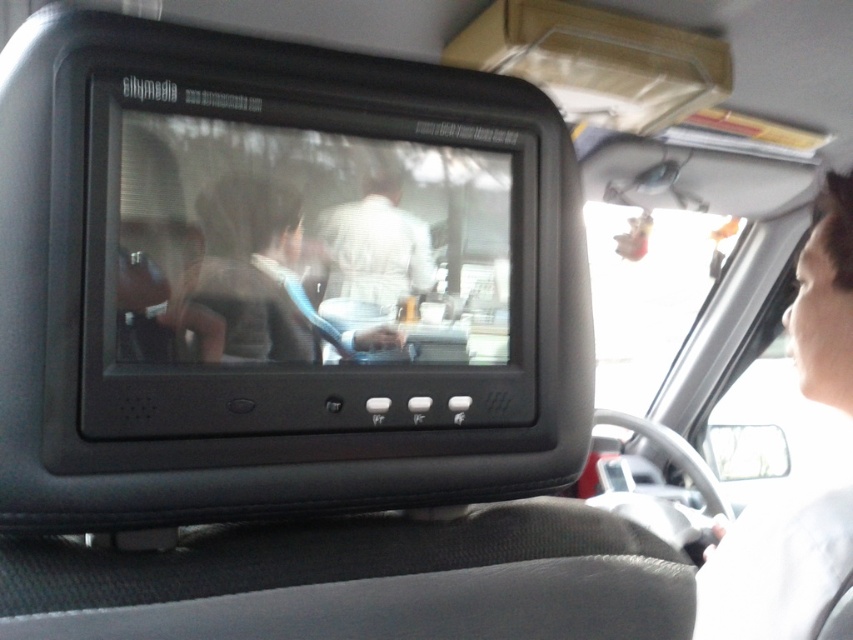
You are a passenger in a car with a small black rectangular monitor mounted on the front passenger seat backrest. The monitor displays a scene from a movie showing two people at a diner counter. You want to adjust your seating position to be exactly 60 centimeters away from the point marked at coordinates (196, 390) on the monitor. Can you achieve this distance?

The point at coordinates (196, 390) is currently 61.55 centimeters away from you. Since this is slightly more than 60 centimeters, you can move closer by approximately 1.55 centimeters to reach the desired distance.

You are a passenger in the car and want to know if the matte black monitor at center can fit inside a rectangular box that is the same height as the light brown hair at upper right. Can it fit?

The matte black monitor at center is not as tall as light brown hair at upper right, so it can fit inside the box.